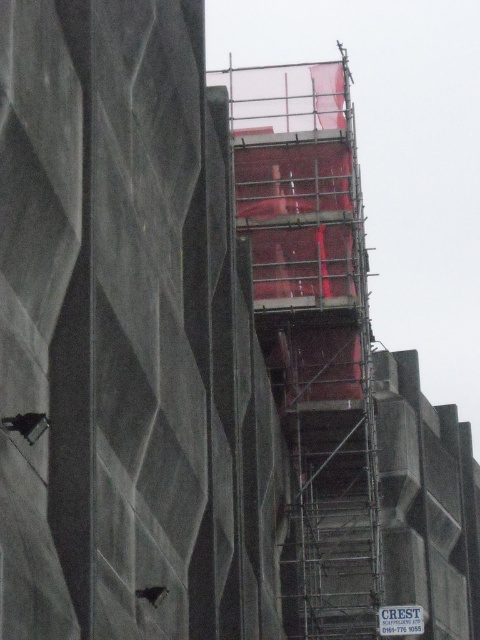
You are a construction worker standing at the base of the building. You need to place a new safety net on the side of the metallic scaffolding at center. However, there is a blue plastic sign at upper center in the way. According to the image, which object is closer to the left edge of the building so you can plan your placement?

The metallic scaffolding at center is positioned on the left side of the blue plastic sign at upper center, so the metallic scaffolding at center is closer to the left edge of the building.

You are a construction worker who needs to place a new safety net on the metallic scaffolding at center. The blue plastic sign at upper center is in the way. Can you move the sign to the side to access the scaffolding?

The metallic scaffolding at center is bigger than the blue plastic sign at upper center, so you can move the blue plastic sign at upper center to the side to access the scaffolding.

You are a construction worker standing at the base of the building. You need to check the blue plastic sign at upper center but first must navigate around the metallic scaffolding at center. Which object will you encounter first as you move toward the sign?

The metallic scaffolding at center is closer to you, so you will encounter it first before reaching the blue plastic sign at upper center.